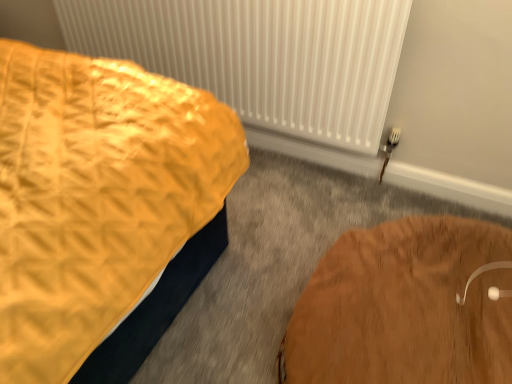
Question: Can you confirm if brown wooden table at lower right is positioned to the right of white textured radiator at upper center?

Choices:
 (A) no
 (B) yes

Answer: (B)

Question: Considering the relative sizes of brown wooden table at lower right and white textured radiator at upper center in the image provided, is brown wooden table at lower right wider than white textured radiator at upper center?

Choices:
 (A) no
 (B) yes

Answer: (B)

Question: From a real-world perspective, is brown wooden table at lower right positioned over white textured radiator at upper center based on gravity?

Choices:
 (A) yes
 (B) no

Answer: (B)

Question: Could white textured radiator at upper center be considered to be inside brown wooden table at lower right?

Choices:
 (A) no
 (B) yes

Answer: (A)

Question: Considering the relative sizes of brown wooden table at lower right and white textured radiator at upper center in the image provided, is brown wooden table at lower right taller than white textured radiator at upper center?

Choices:
 (A) yes
 (B) no

Answer: (B)

Question: Is brown wooden table at lower right far away from white textured radiator at upper center?

Choices:
 (A) no
 (B) yes

Answer: (A)

Question: Is white textured radiator at upper center completely or partially outside of brown wooden table at lower right?

Choices:
 (A) yes
 (B) no

Answer: (A)

Question: Considering the relative positions of white textured radiator at upper center and brown wooden table at lower right in the image provided, is white textured radiator at upper center in front of brown wooden table at lower right?

Choices:
 (A) yes
 (B) no

Answer: (B)

Question: From a real-world perspective, is white textured radiator at upper center over brown wooden table at lower right?

Choices:
 (A) yes
 (B) no

Answer: (A)

Question: Is white textured radiator at upper center bigger than brown wooden table at lower right?

Choices:
 (A) yes
 (B) no

Answer: (B)

Question: Can you confirm if white textured radiator at upper center is shorter than brown wooden table at lower right?

Choices:
 (A) no
 (B) yes

Answer: (A)

Question: Can you confirm if white textured radiator at upper center is wider than brown wooden table at lower right?

Choices:
 (A) no
 (B) yes

Answer: (A)

Question: From their relative heights in the image, would you say brown wooden table at lower right is taller or shorter than white textured radiator at upper center?

Choices:
 (A) short
 (B) tall

Answer: (A)